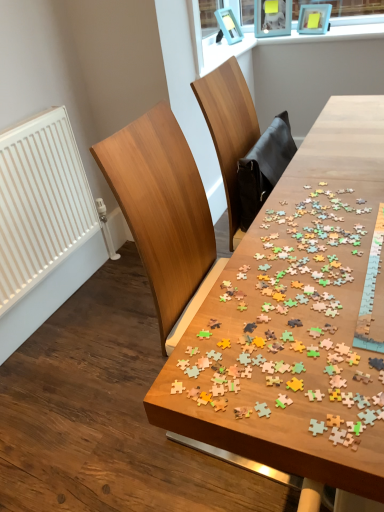
Locate an element on the screen. This screenshot has height=512, width=384. empty space that is ontop of wooden puzzle pieces at center is located at coordinates (337, 193).